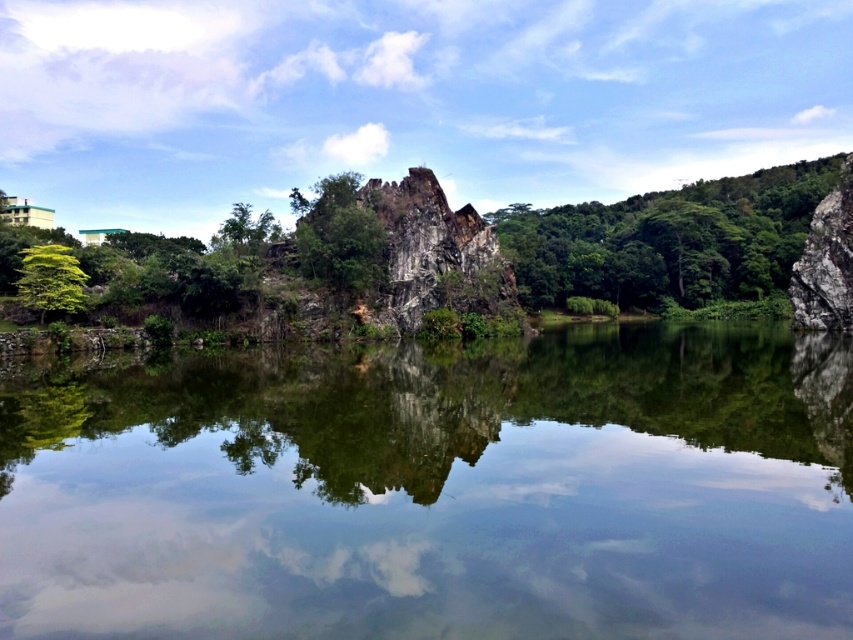
You are a photographer planning to capture the reflection of the green rough rock at center and the green leafy tree at left in the water. Which object will have a larger reflection in the water?

The green rough rock at center has a larger size than the green leafy tree at left, so its reflection in the water will also be larger.

You are standing on the bank of the green reflective water at center and want to walk towards the green leafy tree at left. Which direction should you head?

The green reflective water at center is positioned on the right side of green leafy tree at left, so you should head to the left to reach the green leafy tree at left.

You are standing at the point with coordinates (668,241) in this serene landscape. What object is located exactly at your current position?

The green leafy tree at center is located exactly at the point with coordinates (668,241).